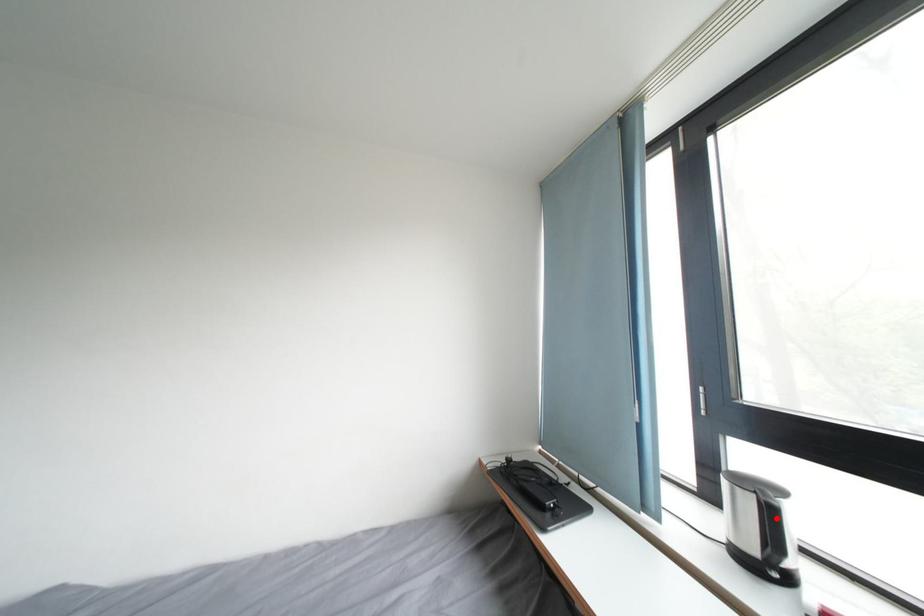
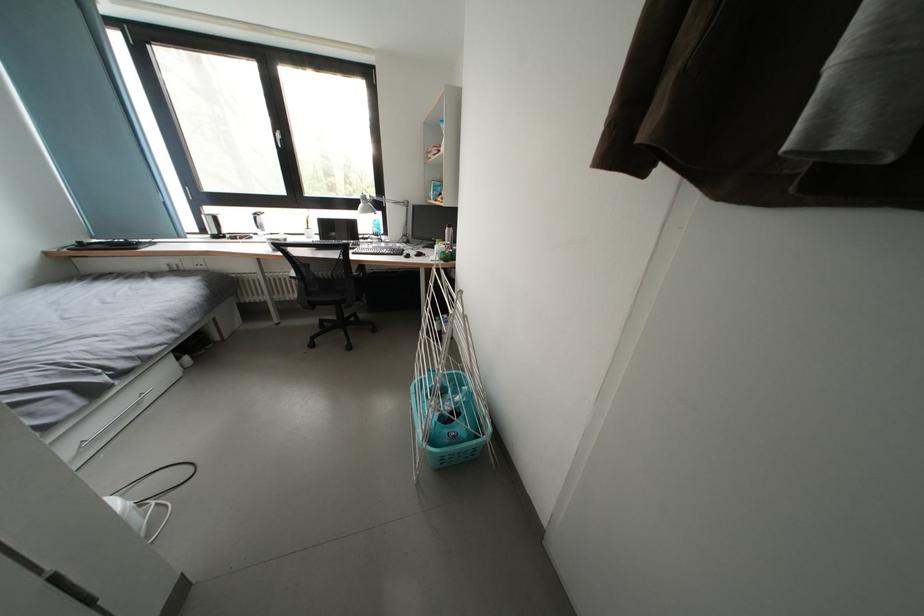
Find the pixel in the second image that matches the highlighted location in the first image.

(223, 223)